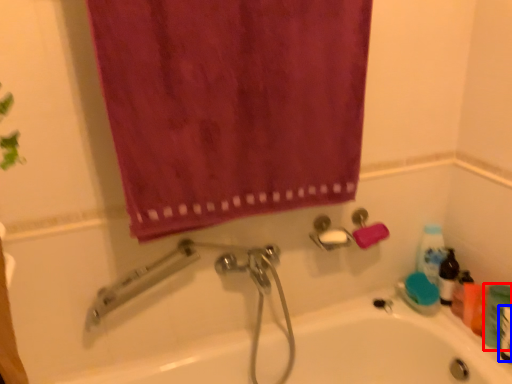
Question: Which object is further to the camera taking this photo, toiletry (highlighted by a red box) or mouthwash (highlighted by a blue box)?

Choices:
 (A) toiletry
 (B) mouthwash

Answer: (A)